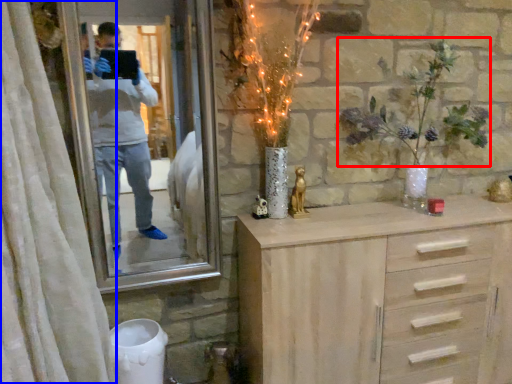
Question: Which point is closer to the camera, floral arrangement (highlighted by a red box) or curtain (highlighted by a blue box)?

Choices:
 (A) floral arrangement
 (B) curtain

Answer: (B)